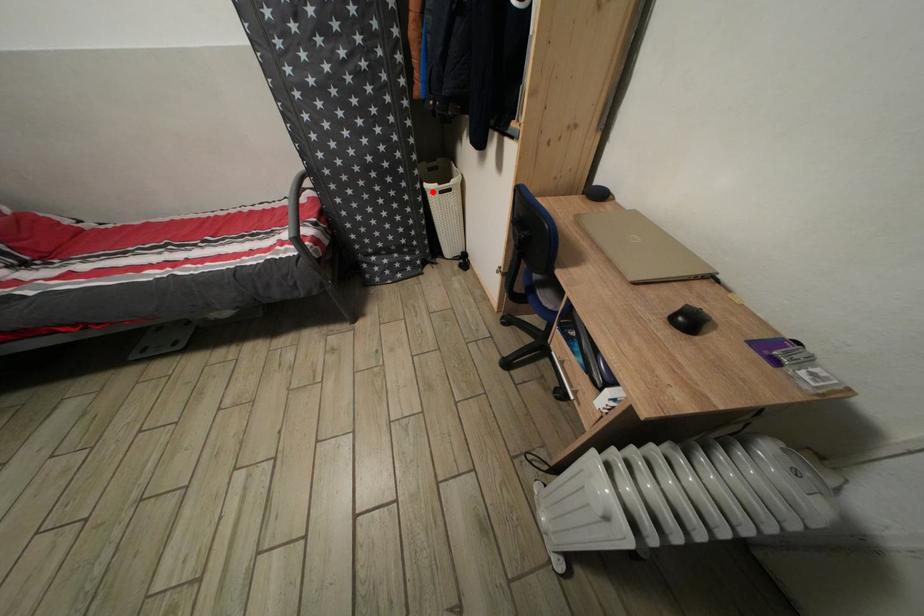
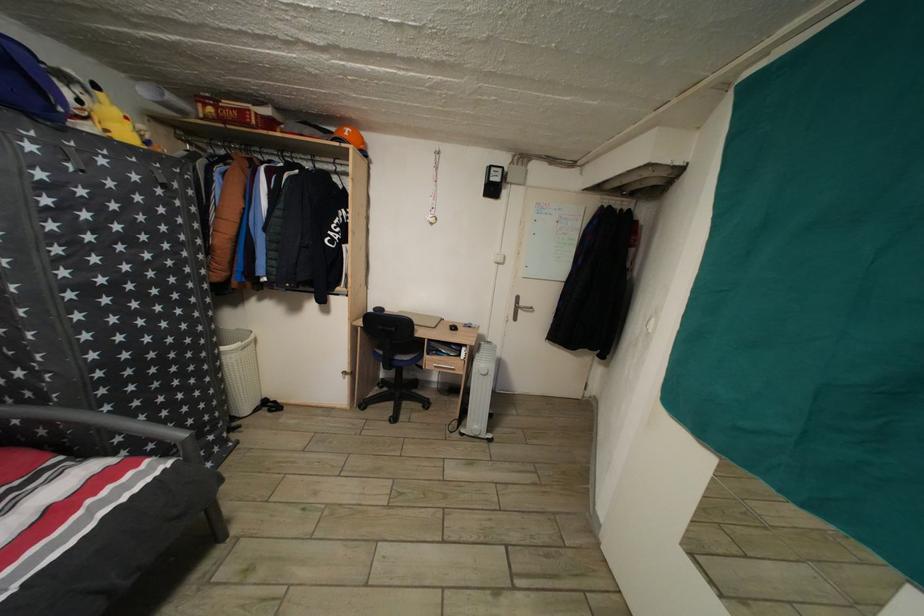
The point at the highlighted location is marked in the first image. Where is the corresponding point in the second image?

(229, 355)